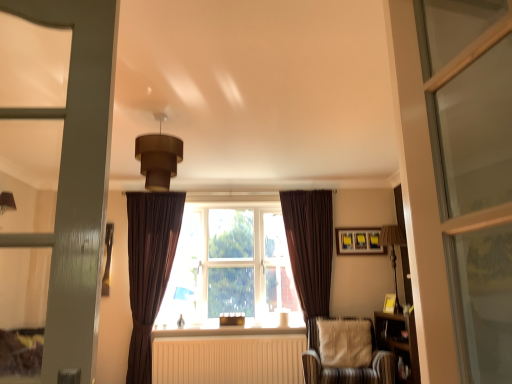
You are a GUI agent. You are given a task and a screenshot of the screen. Output one action in this format:
    pyautogui.click(x=<x>, y=<y>)
    Task: Click on the free location above brown matte/soft pendant light at upper center, the second light fixture in the bottom-to-top sequence (from a real-world perspective)
    Image resolution: width=512 pixels, height=384 pixels.
    Given the screenshot: What is the action you would take?
    pyautogui.click(x=158, y=114)